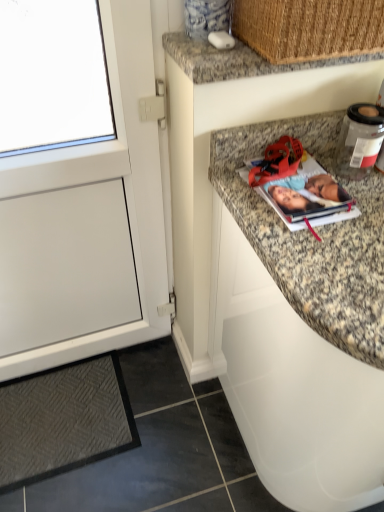
Question: From the image's perspective, is white matte cabinet at left, the 1th cabinetry when ordered from left to right, above granite countertop at upper right, the first cabinetry positioned from the right?

Choices:
 (A) yes
 (B) no

Answer: (A)

Question: Is white matte cabinet at left, which is counted as the 2th cabinetry, starting from the right, oriented towards granite countertop at upper right, the first cabinetry positioned from the right?

Choices:
 (A) no
 (B) yes

Answer: (A)

Question: Is white matte cabinet at left, the 1th cabinetry when ordered from left to right, oriented away from granite countertop at upper right, the 2th cabinetry when ordered from left to right?

Choices:
 (A) no
 (B) yes

Answer: (A)

Question: Considering the relative positions of white matte cabinet at left, which is counted as the 2th cabinetry, starting from the right, and granite countertop at upper right, the first cabinetry positioned from the right, in the image provided, is white matte cabinet at left, which is counted as the 2th cabinetry, starting from the right, to the left of granite countertop at upper right, the first cabinetry positioned from the right, from the viewer's perspective?

Choices:
 (A) yes
 (B) no

Answer: (A)

Question: Is white matte cabinet at left, which is counted as the 2th cabinetry, starting from the right, closer to the viewer compared to granite countertop at upper right, the 2th cabinetry when ordered from left to right?

Choices:
 (A) no
 (B) yes

Answer: (A)

Question: Is granite countertop at upper center taller or shorter than matte paper photo album at upper right?

Choices:
 (A) tall
 (B) short

Answer: (A)

Question: Is granite countertop at upper center to the left or to the right of matte paper photo album at upper right in the image?

Choices:
 (A) right
 (B) left

Answer: (B)

Question: Considering the positions of granite countertop at upper center and matte paper photo album at upper right in the image, is granite countertop at upper center bigger or smaller than matte paper photo album at upper right?

Choices:
 (A) big
 (B) small

Answer: (A)

Question: From the image's perspective, is granite countertop at upper center above or below matte paper photo album at upper right?

Choices:
 (A) above
 (B) below

Answer: (A)

Question: Which is correct: white matte cabinet at left, which is counted as the 2th cabinetry, starting from the right, is inside woven straw basket at upper right, or outside of it?

Choices:
 (A) inside
 (B) outside

Answer: (B)

Question: Is white matte cabinet at left, the 1th cabinetry when ordered from left to right, wider or thinner than woven straw basket at upper right?

Choices:
 (A) wide
 (B) thin

Answer: (B)

Question: Considering the positions of point (82, 173) and point (271, 15), is point (82, 173) closer or farther from the camera than point (271, 15)?

Choices:
 (A) farther
 (B) closer

Answer: (A)

Question: In terms of height, does white matte cabinet at left, which is counted as the 2th cabinetry, starting from the right, look taller or shorter compared to woven straw basket at upper right?

Choices:
 (A) short
 (B) tall

Answer: (B)

Question: Is matte paper photo album at upper right in front of or behind dark gray textured mat at lower left in the image?

Choices:
 (A) behind
 (B) front

Answer: (B)

Question: Is matte paper photo album at upper right wider or thinner than dark gray textured mat at lower left?

Choices:
 (A) thin
 (B) wide

Answer: (A)